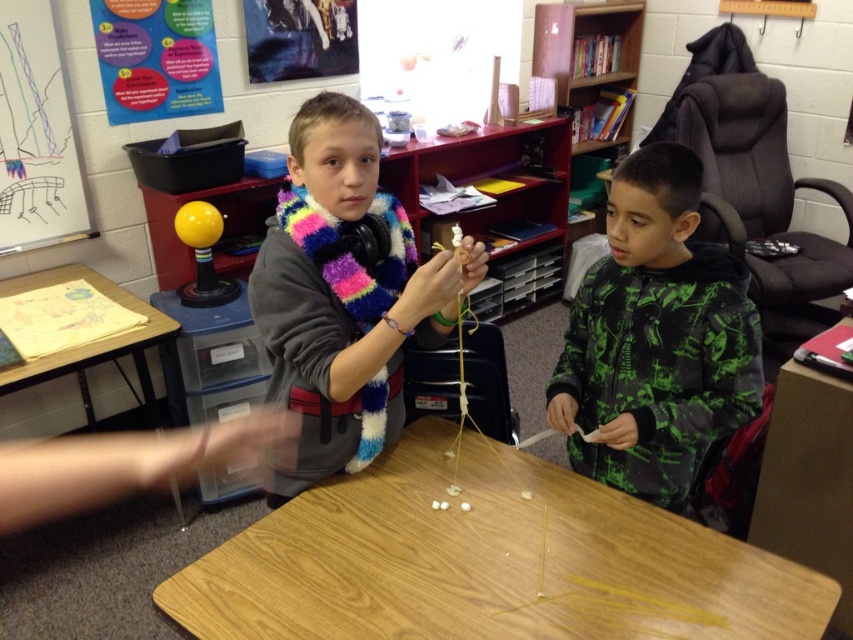
Question: Which object appears closest to the camera in this image?

Choices:
 (A) multicolored fuzzy scarf at center
 (B) whiteboard at upper left

Answer: (A)

Question: Is wooden table at center above multicolored fuzzy scarf at center?

Choices:
 (A) yes
 (B) no

Answer: (B)

Question: Which object is positioned farthest from the wooden table at left?

Choices:
 (A) multicolored fuzzy scarf at center
 (B) whiteboard at upper left
 (C) wooden table at center

Answer: (C)

Question: Is the position of wooden table at center more distant than that of wooden table at left?

Choices:
 (A) no
 (B) yes

Answer: (A)

Question: Which of the following is the closest to the observer?

Choices:
 (A) multicolored fuzzy scarf at center
 (B) green camouflage hoodie at center
 (C) wooden table at left

Answer: (A)

Question: Can you confirm if multicolored fuzzy scarf at center is positioned to the left of whiteboard at upper left?

Choices:
 (A) yes
 (B) no

Answer: (B)